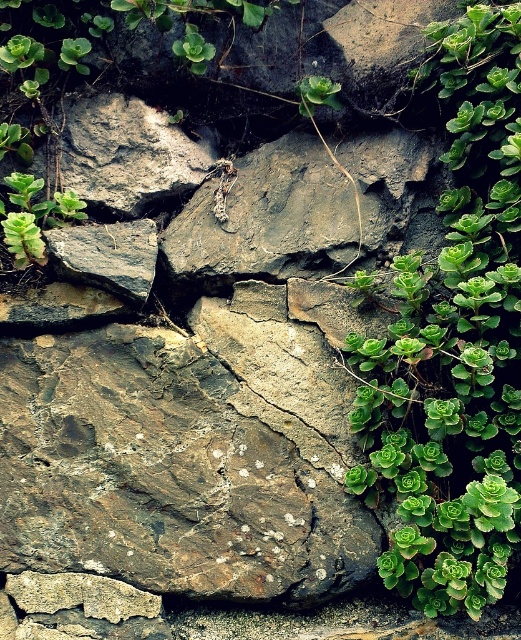
Question: Is rusty stone wall at center above green succulent at right?

Choices:
 (A) yes
 (B) no

Answer: (B)

Question: Does rusty stone wall at center have a smaller size compared to green succulent at right?

Choices:
 (A) no
 (B) yes

Answer: (B)

Question: Which point is farther to the camera?

Choices:
 (A) (488, 454)
 (B) (178, 444)

Answer: (B)

Question: Is rusty stone wall at center positioned before green succulent at right?

Choices:
 (A) yes
 (B) no

Answer: (B)